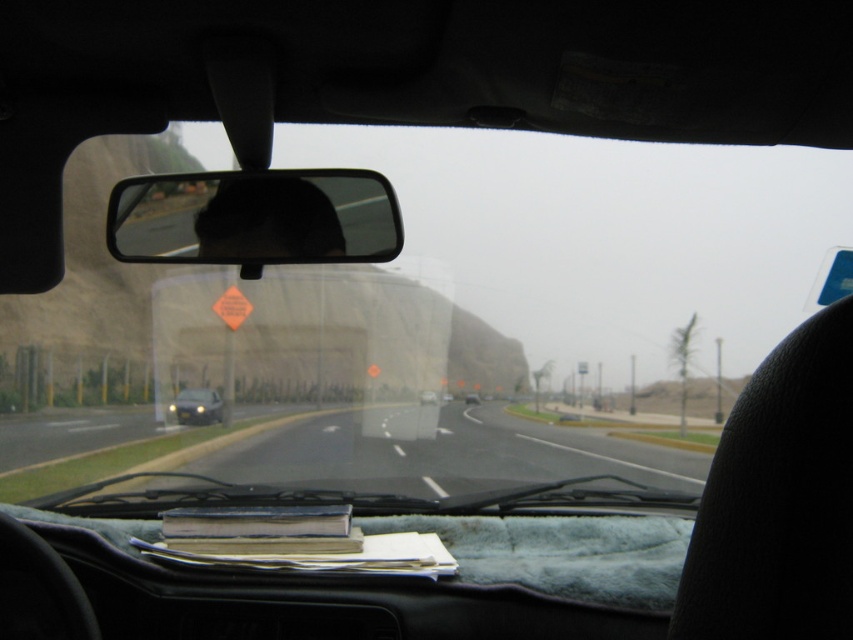
You are a passenger in the car and want to reach the point marked as point [258,173] on the windshield. The distance between you and the point is 9.16 feet. Can you safely reach it without leaning too far forward?

The point [258,173] is 9.16 feet away from you. Since this distance is relatively large, reaching it might require leaning forward significantly, which could be unsafe while the car is moving. It is advisable to avoid reaching for it to prevent distraction or loss of balance.